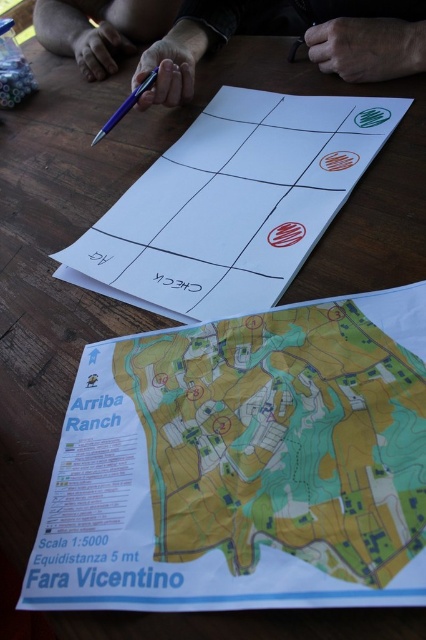
Based on the provided map of Arriba Ranch, there is a specific point marked at coordinates (232, 204). What does this point indicate?

The point at coordinates (232, 204) marks the location of the white paper at center.

You are a guest at Arriba Ranch and need to locate the nearest water source. You have a green paper map at center and a matte purple pen at upper center on the table. Which object would you pick up first to mark the location of the water source on the map?

You should pick up the matte purple pen at upper center first because the green paper map at center is closer to the viewer, making it easier to mark without reaching over it.